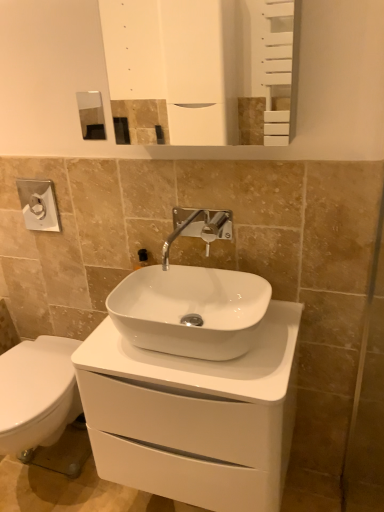
Question: Considering the relative sizes of satin nickel faucet at center and white glossy mirror at upper center in the image provided, is satin nickel faucet at center wider than white glossy mirror at upper center?

Choices:
 (A) no
 (B) yes

Answer: (A)

Question: Is satin nickel faucet at center positioned before white glossy mirror at upper center?

Choices:
 (A) no
 (B) yes

Answer: (A)

Question: Is satin nickel faucet at center positioned far away from white glossy mirror at upper center?

Choices:
 (A) yes
 (B) no

Answer: (A)

Question: From the image's perspective, is satin nickel faucet at center on white glossy mirror at upper center?

Choices:
 (A) yes
 (B) no

Answer: (B)

Question: From the image's perspective, is satin nickel faucet at center below white glossy mirror at upper center?

Choices:
 (A) no
 (B) yes

Answer: (B)

Question: Relative to white glossy cabinet at center, is satin nickel faucet at center in front or behind?

Choices:
 (A) front
 (B) behind

Answer: (B)

Question: Looking at their shapes, would you say satin nickel faucet at center is wider or thinner than white glossy cabinet at center?

Choices:
 (A) thin
 (B) wide

Answer: (A)

Question: From the image's perspective, is satin nickel faucet at center located above or below white glossy cabinet at center?

Choices:
 (A) above
 (B) below

Answer: (A)

Question: Do you think satin nickel faucet at center is within white glossy cabinet at center, or outside of it?

Choices:
 (A) inside
 (B) outside

Answer: (B)

Question: Would you say white glossy mirror at upper center is to the left or to the right of satin nickel faucet at center in the picture?

Choices:
 (A) left
 (B) right

Answer: (B)

Question: Is white glossy mirror at upper center inside the boundaries of satin nickel faucet at center, or outside?

Choices:
 (A) outside
 (B) inside

Answer: (A)

Question: In the image, is white glossy mirror at upper center positioned in front of or behind satin nickel faucet at center?

Choices:
 (A) front
 (B) behind

Answer: (A)

Question: From the image's perspective, is white glossy mirror at upper center above or below satin nickel faucet at center?

Choices:
 (A) above
 (B) below

Answer: (A)

Question: From the image's perspective, relative to white glossy cabinet at center, is white glossy mirror at upper center above or below?

Choices:
 (A) above
 (B) below

Answer: (A)

Question: From their relative heights in the image, would you say white glossy mirror at upper center is taller or shorter than white glossy cabinet at center?

Choices:
 (A) tall
 (B) short

Answer: (B)